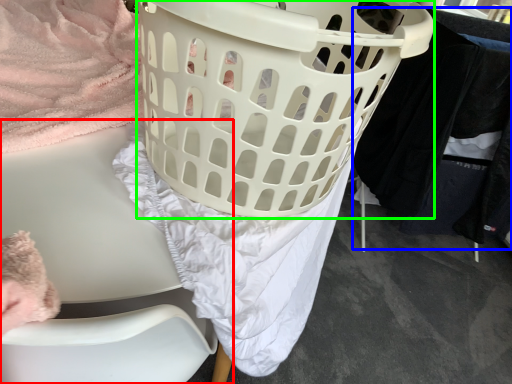
Question: Based on their relative distances, which object is farther from furniture (highlighted by a red box)? Choose from clothing (highlighted by a blue box) and basket (highlighted by a green box).

Choices:
 (A) clothing
 (B) basket

Answer: (A)